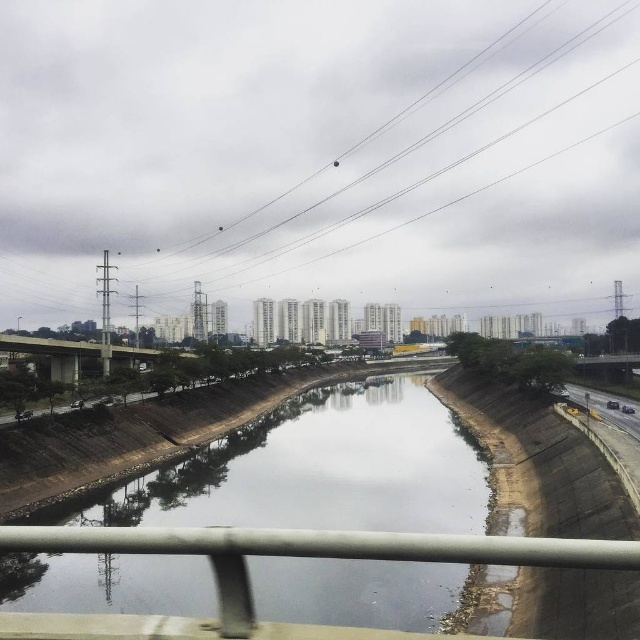
Question: Is metallic wire at upper center wider than concrete bridge at center?

Choices:
 (A) yes
 (B) no

Answer: (A)

Question: From the image, what is the correct spatial relationship of clear concrete river at center in relation to metallic wire at upper center?

Choices:
 (A) above
 (B) below

Answer: (B)

Question: Which point is closer to the camera?

Choices:
 (A) concrete bridge at center
 (B) metallic wire at upper center

Answer: (A)

Question: Which point is closer to the camera?

Choices:
 (A) pyautogui.click(x=148, y=349)
 (B) pyautogui.click(x=310, y=176)
 (C) pyautogui.click(x=298, y=412)

Answer: (A)

Question: Can you confirm if clear concrete river at center is positioned above concrete bridge at center?

Choices:
 (A) yes
 (B) no

Answer: (B)

Question: Which point is closer to the camera?

Choices:
 (A) (68, 365)
 (B) (496, 38)
 (C) (97, 509)

Answer: (C)